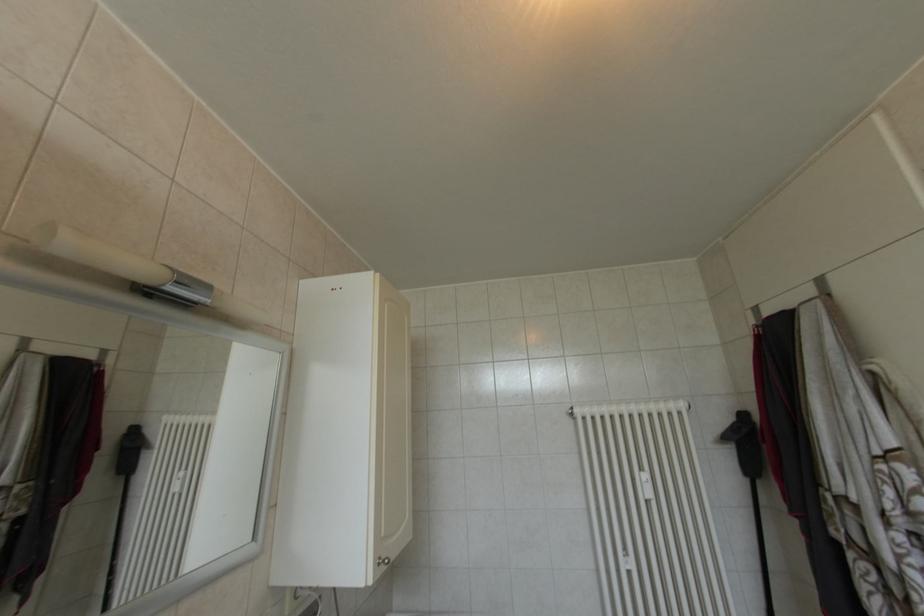
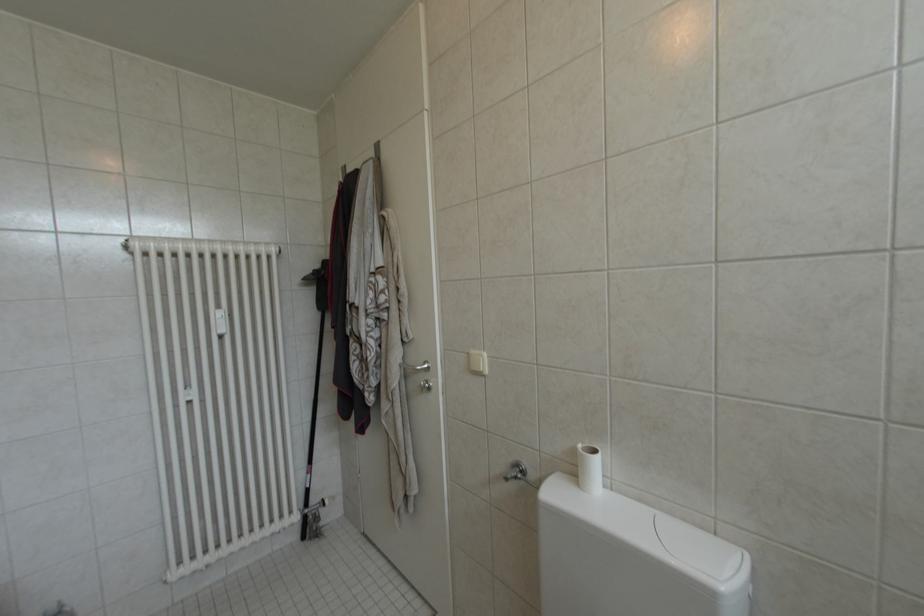
Question: How did the camera likely rotate?

Choices:
 (A) Left
 (B) Right
 (C) Up
 (D) Down

Answer: (B)